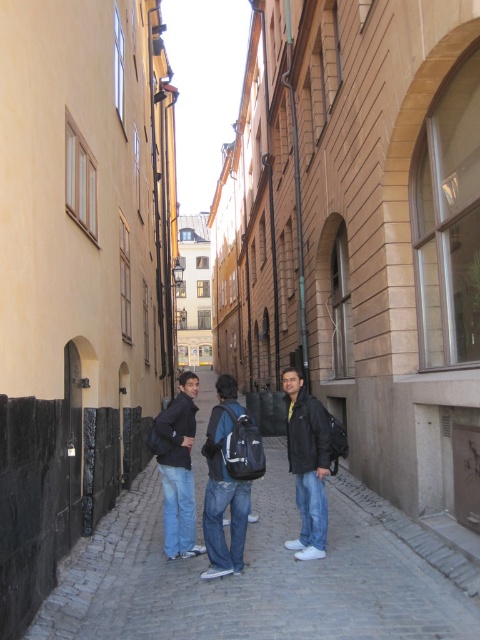
Is gray cobblestone pavement at lower center shorter than black matte jacket at center?

Yes.

Who is more distant from viewer, (288,509) or (288,460)?

Positioned behind is point (288,460).

Which is behind, point (139, 536) or point (328, 426)?

Point (139, 536)

I want to click on gray cobblestone pavement at lower center, so click(264, 573).

Which is behind, point (228, 428) or point (307, 516)?

Point (307, 516)

Find the location of a particular element. Image resolution: width=480 pixels, height=640 pixels. dark blue jeans at center is located at coordinates (228, 477).

Looking at this image, which of these two, dark blue jeans at center or jeans at center, stands taller?

With more height is jeans at center.

Is dark blue jeans at center smaller than jeans at center?

Yes.

At what (x,y) coordinates should I click in order to perform the action: click on dark blue jeans at center. Please return your answer as a coordinate pair (x, y). The width and height of the screenshot is (480, 640). Looking at the image, I should click on (228, 477).